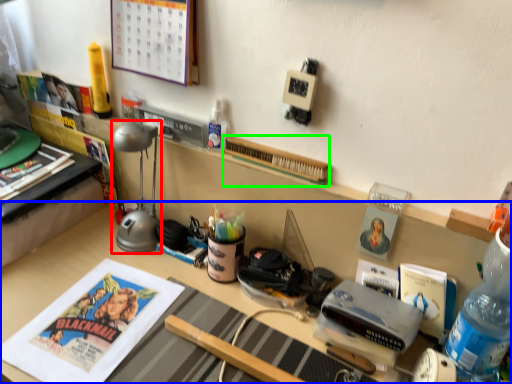
Question: Estimate the real-world distances between objects in this image. Which object is farther from table lamp (highlighted by a red box), desk (highlighted by a blue box) or book (highlighted by a green box)?

Choices:
 (A) desk
 (B) book

Answer: (B)